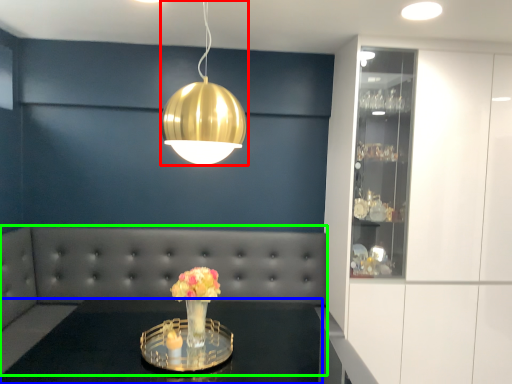
Question: Considering the real-world distances, which object is closest to lamp (highlighted by a red box)? table (highlighted by a blue box) or couch (highlighted by a green box).

Choices:
 (A) table
 (B) couch

Answer: (A)